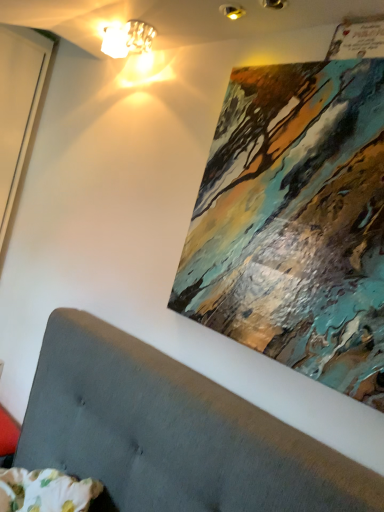
Question: Are abstract painting at upper right and matte glass lampshade at upper center beside each other?

Choices:
 (A) no
 (B) yes

Answer: (A)

Question: From a real-world perspective, is abstract painting at upper right below matte glass lampshade at upper center?

Choices:
 (A) no
 (B) yes

Answer: (B)

Question: From the image's perspective, would you say abstract painting at upper right is positioned over matte glass lampshade at upper center?

Choices:
 (A) no
 (B) yes

Answer: (A)

Question: Is abstract painting at upper right surrounding matte glass lampshade at upper center?

Choices:
 (A) no
 (B) yes

Answer: (A)

Question: Is abstract painting at upper right oriented towards matte glass lampshade at upper center?

Choices:
 (A) yes
 (B) no

Answer: (B)

Question: Can you confirm if abstract painting at upper right is smaller than matte glass lampshade at upper center?

Choices:
 (A) no
 (B) yes

Answer: (A)

Question: Considering the relative sizes of matte glass lampshade at upper center and abstract painting at upper right in the image provided, is matte glass lampshade at upper center wider than abstract painting at upper right?

Choices:
 (A) yes
 (B) no

Answer: (A)

Question: Considering the relative positions of matte glass lampshade at upper center and abstract painting at upper right in the image provided, is matte glass lampshade at upper center in front of abstract painting at upper right?

Choices:
 (A) no
 (B) yes

Answer: (A)

Question: Is the depth of matte glass lampshade at upper center greater than that of abstract painting at upper right?

Choices:
 (A) no
 (B) yes

Answer: (B)

Question: From the image's perspective, is matte glass lampshade at upper center beneath abstract painting at upper right?

Choices:
 (A) yes
 (B) no

Answer: (B)

Question: Is matte glass lampshade at upper center not within abstract painting at upper right?

Choices:
 (A) yes
 (B) no

Answer: (A)

Question: Does matte glass lampshade at upper center have a lesser width compared to abstract painting at upper right?

Choices:
 (A) yes
 (B) no

Answer: (B)

Question: In terms of size, does abstract painting at upper right appear bigger or smaller than matte glass lampshade at upper center?

Choices:
 (A) small
 (B) big

Answer: (B)